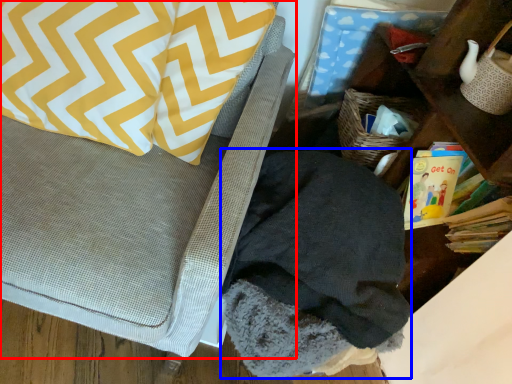
Question: Which point is further to the camera, furniture (highlighted by a red box) or clothing (highlighted by a blue box)?

Choices:
 (A) furniture
 (B) clothing

Answer: (B)